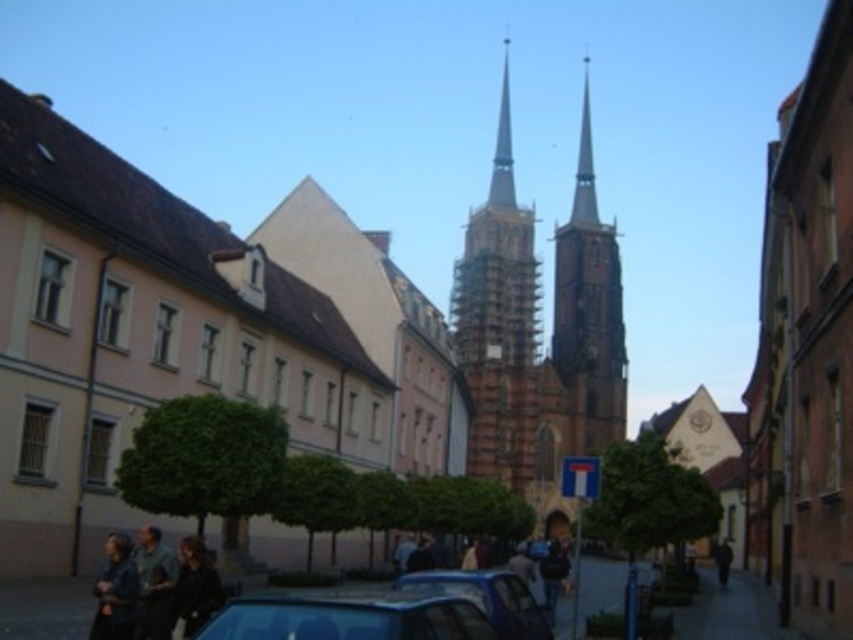
This screenshot has width=853, height=640. In order to click on brown wooden tower at center in this screenshot , I will do `click(498, 321)`.

Find the location of `brown wooden tower at center`. brown wooden tower at center is located at coordinates pyautogui.click(x=498, y=321).

Is the position of dark blue shirt at lower left less distant than that of dark gray jacket at center?

Yes, it is.

Which is more to the right, dark blue shirt at lower left or dark gray jacket at center?

dark gray jacket at center is more to the right.

Describe the element at coordinates (154, 586) in the screenshot. I see `dark blue shirt at lower left` at that location.

Where is `dark blue shirt at lower left`? This screenshot has height=640, width=853. dark blue shirt at lower left is located at coordinates (154, 586).

Can you confirm if dark brown leather jacket at lower center is shorter than dark gray jacket at center?

Correct, dark brown leather jacket at lower center is not as tall as dark gray jacket at center.

Does point (180, 592) come farther from viewer compared to point (717, 554)?

No, it is not.

The image size is (853, 640). I want to click on dark brown leather jacket at lower center, so click(195, 586).